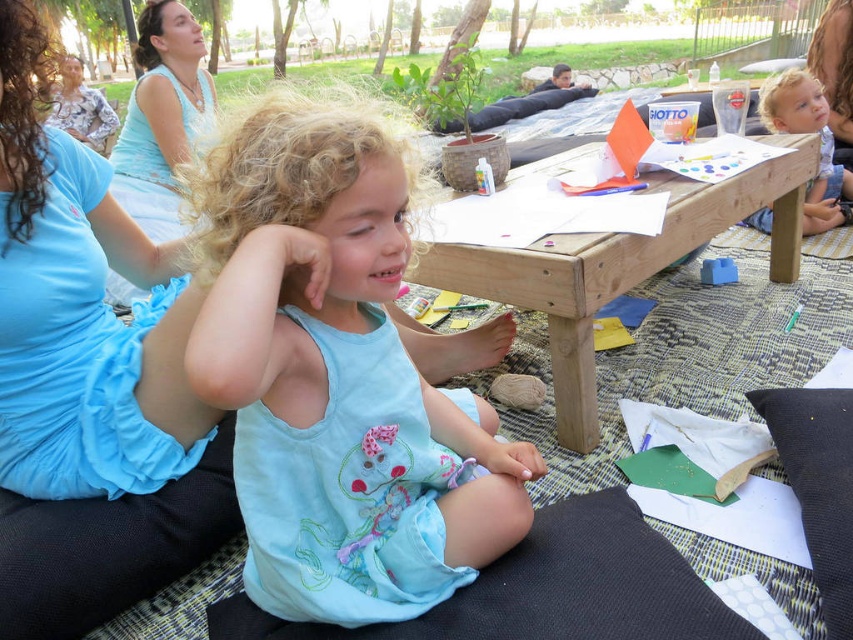
Can you confirm if light blue fabric dress at center is bigger than matte blue tank top at upper left?

No.

Does point (239, 490) lie behind point (199, 109)?

No, it is in front of (199, 109).

Image resolution: width=853 pixels, height=640 pixels. In order to click on light blue fabric dress at center in this screenshot , I will do `click(339, 380)`.

The height and width of the screenshot is (640, 853). I want to click on light blue fabric dress at center, so click(x=339, y=380).

Can you confirm if wooden picnic table at center is shorter than matte blue tank top at upper left?

Indeed, wooden picnic table at center has a lesser height compared to matte blue tank top at upper left.

Is wooden picnic table at center bigger than matte blue tank top at upper left?

Correct, wooden picnic table at center is larger in size than matte blue tank top at upper left.

Locate an element on the screen. wooden picnic table at center is located at coordinates (619, 268).

Describe the element at coordinates (160, 116) in the screenshot. I see `matte blue tank top at upper left` at that location.

Between matte blue tank top at upper left and blonde hair at upper right, which one is positioned higher?

matte blue tank top at upper left is above.

Who is more distant from viewer, (136,198) or (809,189)?

Positioned behind is point (136,198).

Locate an element on the screen. matte blue tank top at upper left is located at coordinates (160, 116).